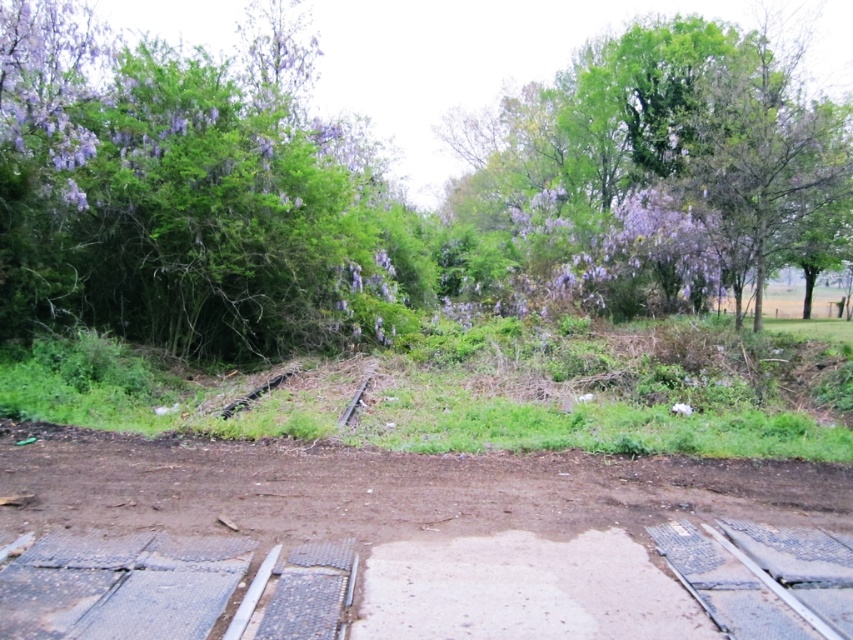
Question: Can you confirm if green leafy tree at upper left is positioned below brown dirt track at center?

Choices:
 (A) yes
 (B) no

Answer: (B)

Question: Can you confirm if brown dirt track at center is positioned above purple leafy tree at upper left?

Choices:
 (A) no
 (B) yes

Answer: (A)

Question: Estimate the real-world distances between objects in this image. Which object is farther from the green leafy tree at upper left?

Choices:
 (A) purple leafy bush at upper left
 (B) purple leafy tree at upper left

Answer: (A)

Question: Is green leafy tree at upper left closer to camera compared to brown dirt track at center?

Choices:
 (A) yes
 (B) no

Answer: (B)

Question: Considering the real-world distances, which object is closest to the brown dirt track at center?

Choices:
 (A) purple leafy bush at upper left
 (B) purple leafy tree at upper left

Answer: (A)

Question: Which point is farther to the camera?

Choices:
 (A) brown dirt track at center
 (B) purple leafy bush at upper left
 (C) purple leafy tree at upper left
 (D) green leafy tree at upper left

Answer: (C)